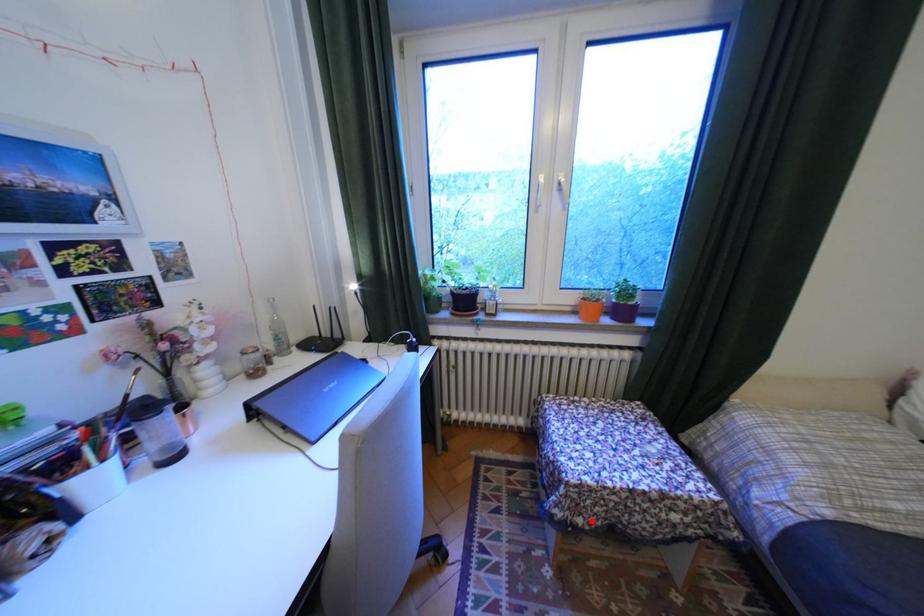
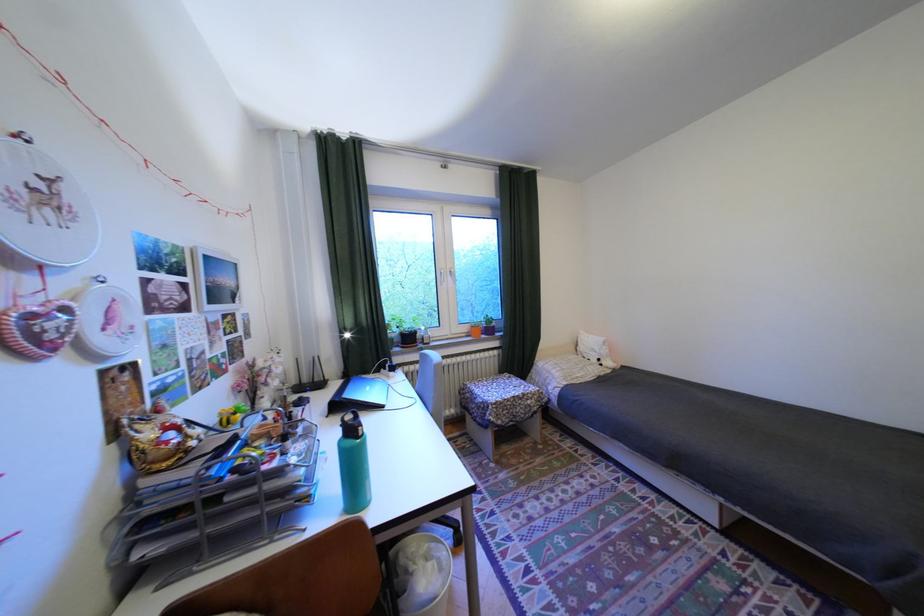
Find the pixel in the second image that matches the highlighted location in the first image.

(512, 422)